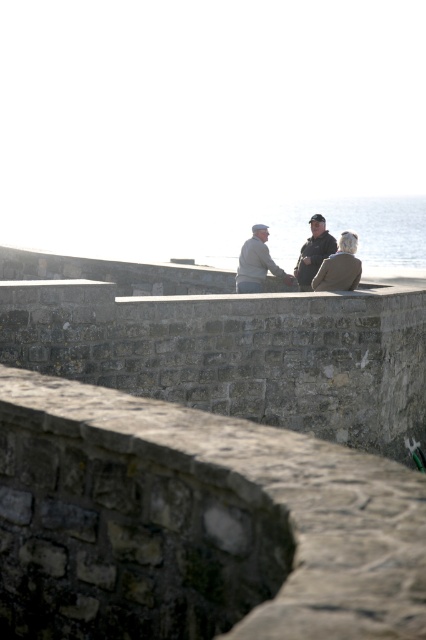
Is light gray sweater at center below dark gray jacket at center?

Correct, light gray sweater at center is located below dark gray jacket at center.

Looking at this image, does light gray sweater at center appear on the left side of dark gray jacket at center?

Correct, you'll find light gray sweater at center to the left of dark gray jacket at center.

This screenshot has height=640, width=426. Identify the location of light gray sweater at center. (256, 262).

Can you confirm if dark gray knit hat at center is thinner than light gray sweater at center?

No.

Does dark gray knit hat at center have a greater width compared to light gray sweater at center?

Correct, the width of dark gray knit hat at center exceeds that of light gray sweater at center.

Between point (258, 252) and point (256, 284), which one is positioned behind?

Positioned behind is point (258, 252).

Locate an element on the screen. dark gray knit hat at center is located at coordinates (276, 264).

Which of these two, dark gray knit hat at center or dark gray jacket at center, stands taller?

dark gray jacket at center

Is dark gray knit hat at center above dark gray jacket at center?

No.

Image resolution: width=426 pixels, height=640 pixels. I want to click on dark gray knit hat at center, so click(276, 264).